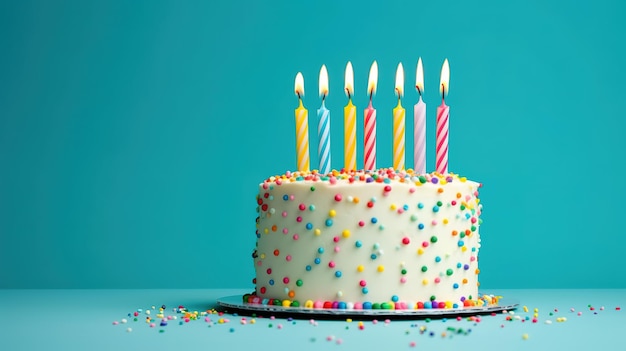
The width and height of the screenshot is (626, 351). Identify the location of candle flames. (302, 101), (325, 92), (355, 96), (370, 101), (392, 93), (418, 90), (448, 84).